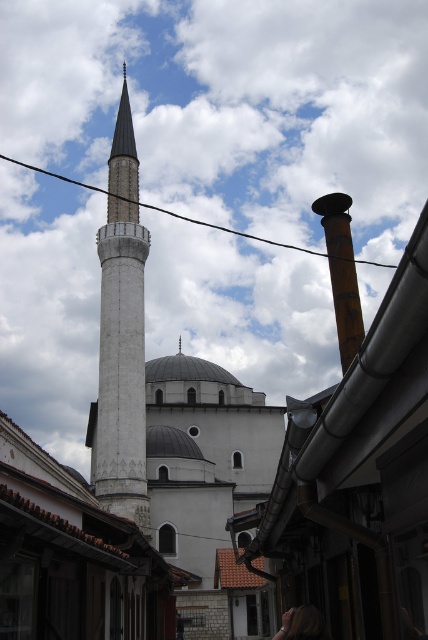
You are standing in front of the mosque and see two points marked on the minaret. The first point is at coordinates point (x=142, y=442) and the second point is at point (x=258, y=237). Which point is closer to you?

Point (x=142, y=442) is closer to the viewer than point (x=258, y=237).

You are standing in front of a mosque and notice two features in the image. The white stone minaret at left and the black wire at upper center. Which of these two objects is positioned more to the left side of the image?

The white stone minaret at left is positioned more to the left side of the image compared to the black wire at upper center.

Based on the photo, you are a drone operator tasked with capturing aerial footage of the mosque. The drone is currently positioned at the center of the scene. To ensure the white stone minaret at left is in frame, should you adjust the drone to the left or right?

The white stone minaret at left is located at point (121, 336), so you should adjust the drone to the left to keep the white stone minaret at left in frame.